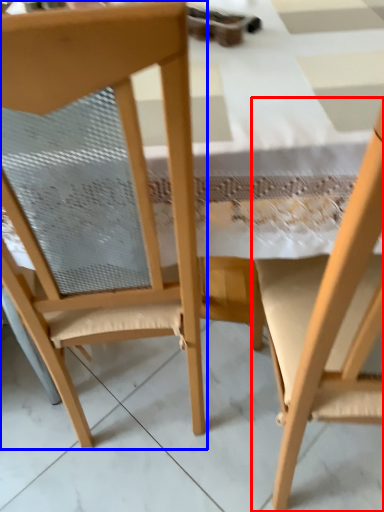
Question: Among these objects, which one is farthest to the camera, chair (highlighted by a red box) or chair (highlighted by a blue box)?

Choices:
 (A) chair
 (B) chair

Answer: (B)